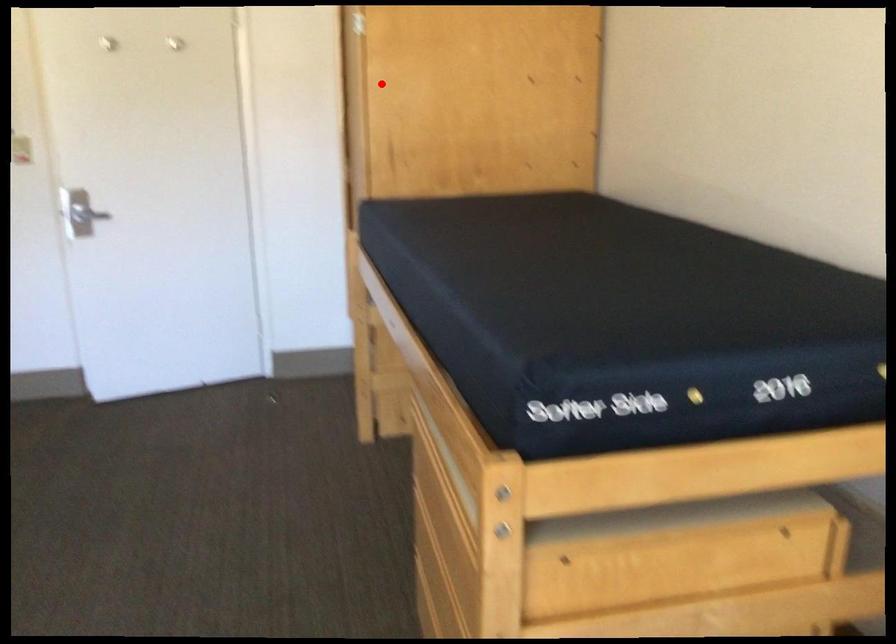
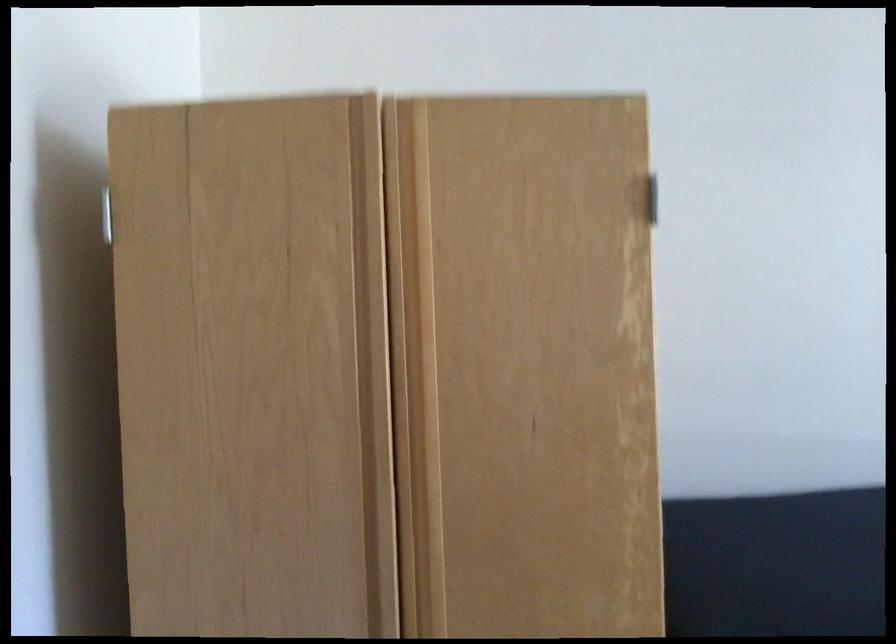
Question: I am providing you with two images of the same scene from different viewpoints. A red point is marked on the first image. At the location where the point appears in image 1, is it still visible in image 2?

Choices:
 (A) Yes
 (B) No

Answer: (A)